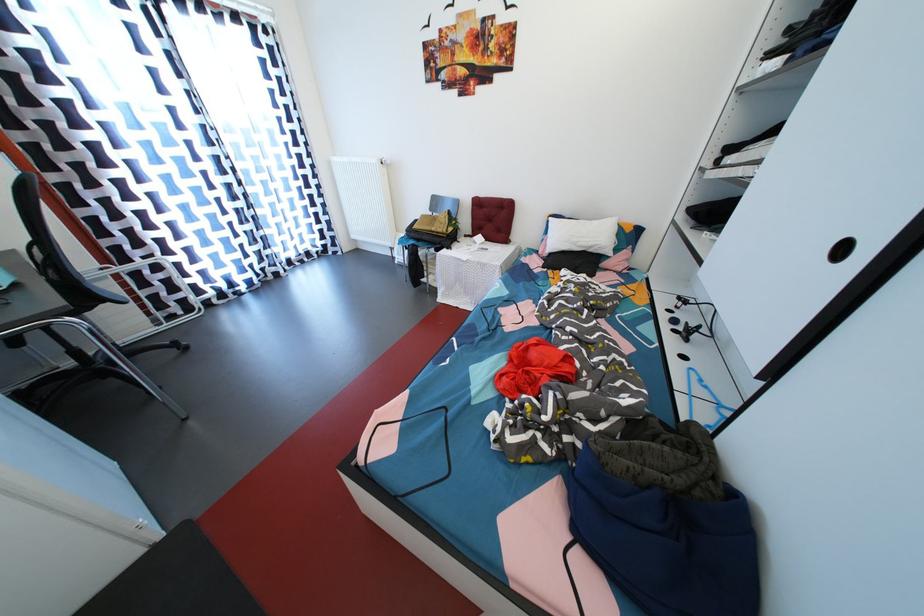
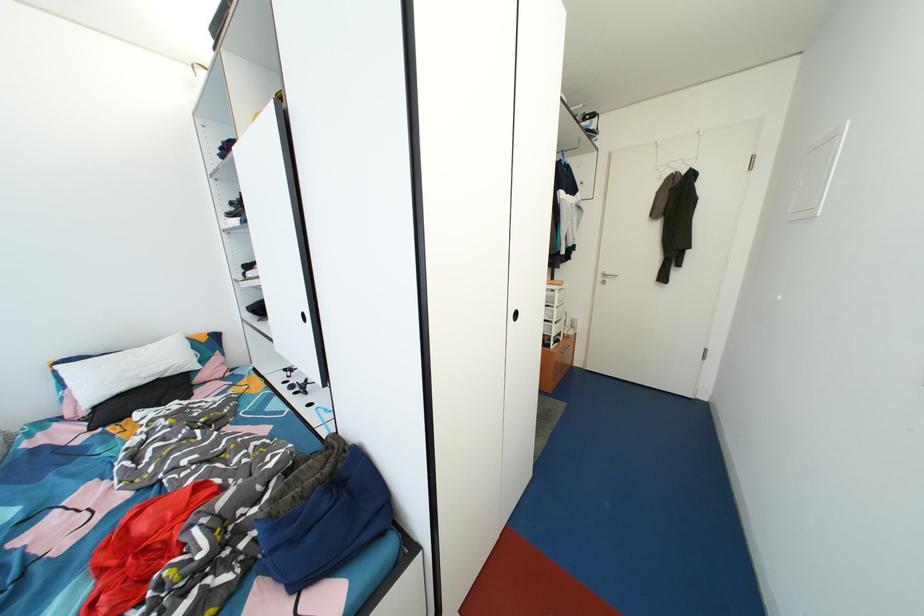
Question: The images are taken continuously from a first-person perspective. In which direction is your viewpoint rotating?

Choices:
 (A) Left
 (B) Right
 (C) Up
 (D) Down

Answer: (B)